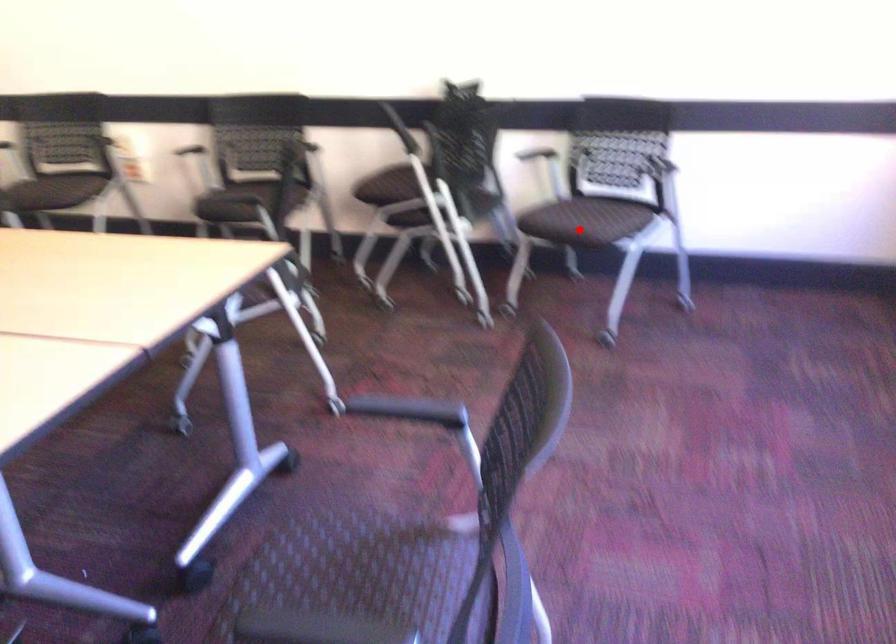
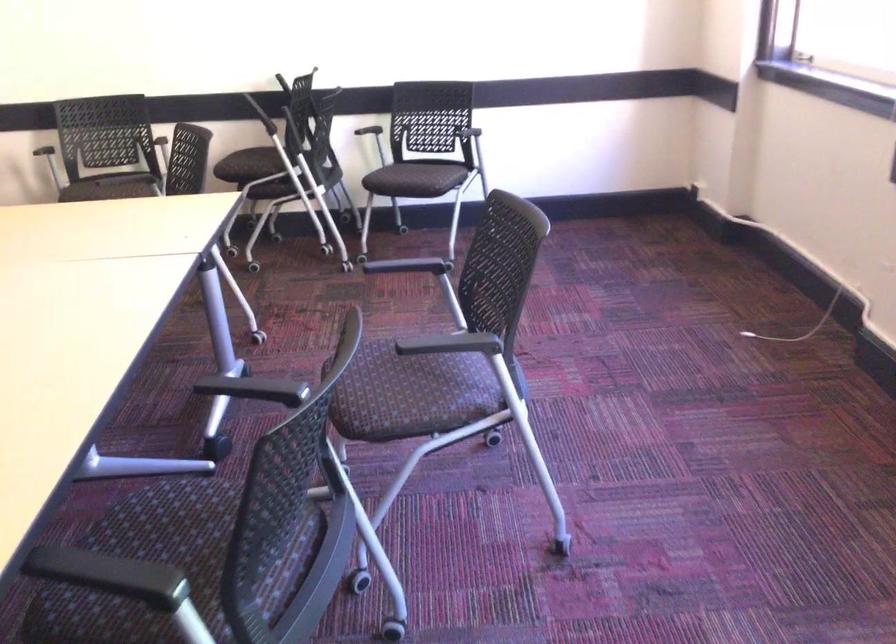
Where in the second image is the point corresponding to the highlighted location from the first image?

(415, 178)